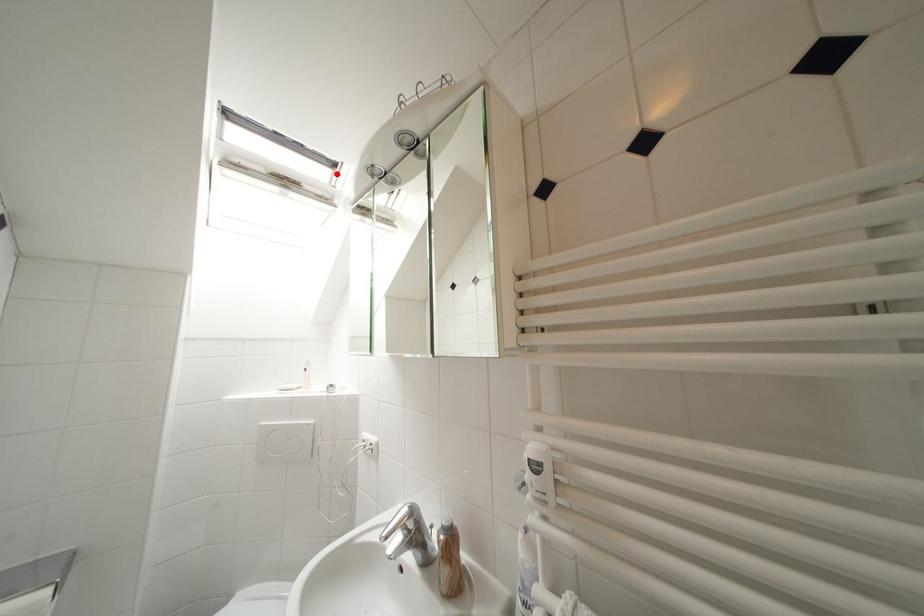
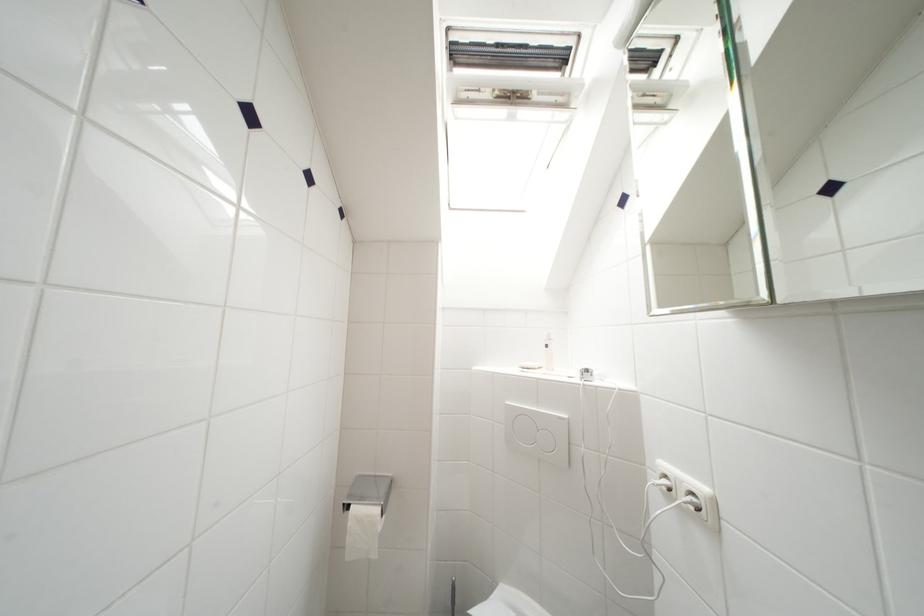
Find the pixel in the second image that matches the highlighted location in the first image.

(565, 77)